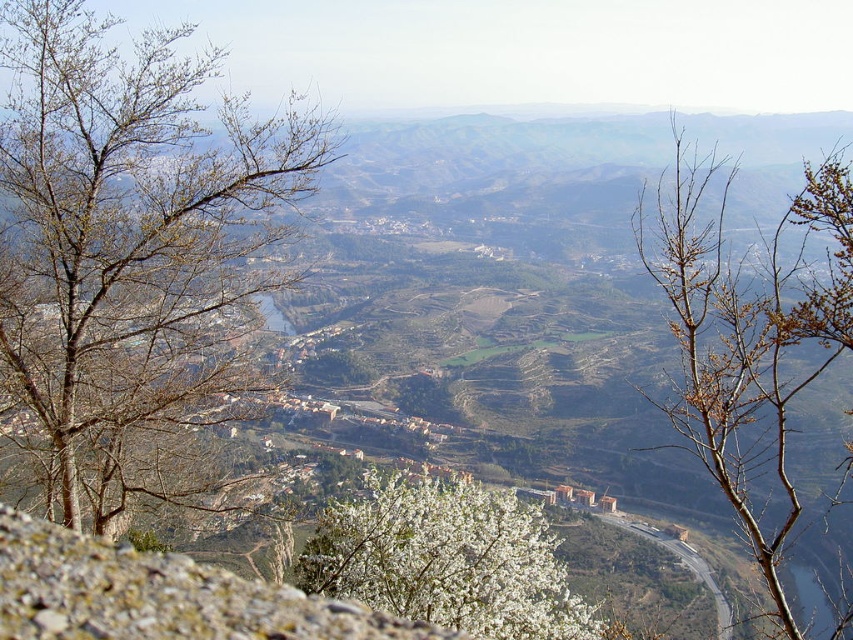
Based on the photo, you are a hiker standing at the base of the rocky outcrop in the valley. You spot two sets of bare branches in the scene. How far apart are the bare branches at left and the bare branches at upper center?

The bare branches at left and the bare branches at upper center are 79.28 meters apart.

Consider the image. You are standing at the highest point of the valley and looking down. There are two points marked on the landscape, point 1 at coordinates point (20,321) and point 2 at coordinates point (367,493). Which point is closer to you?

Point (20,321) is closer to the camera than point (367,493), so point 1 is closer to you.

You are an ornithologist observing the valley from the rocky outcrop. You notice the bare branches at upper center and the white blossoming bush at center. Which object is located higher in the scene?

The bare branches at upper center is positioned over the white blossoming bush at center, so it is higher.